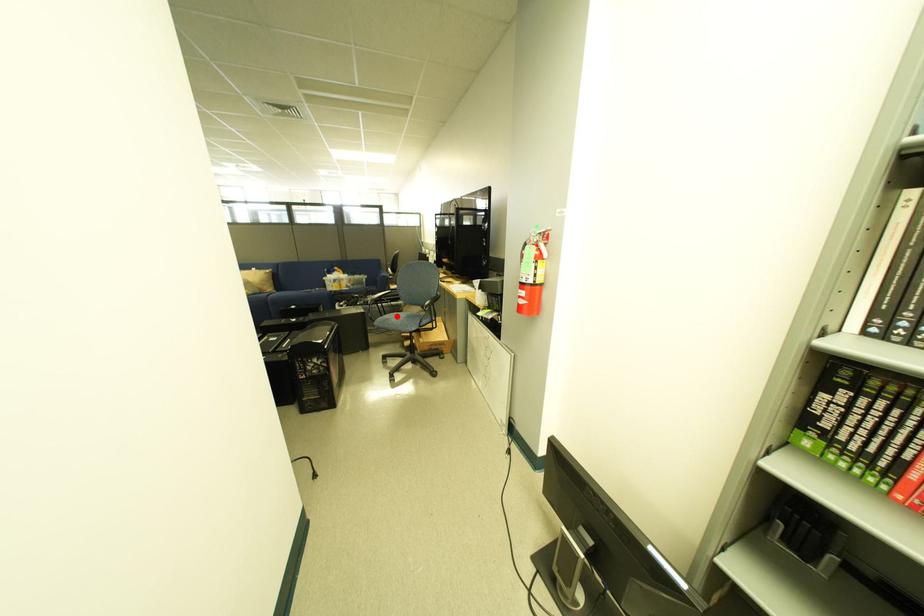
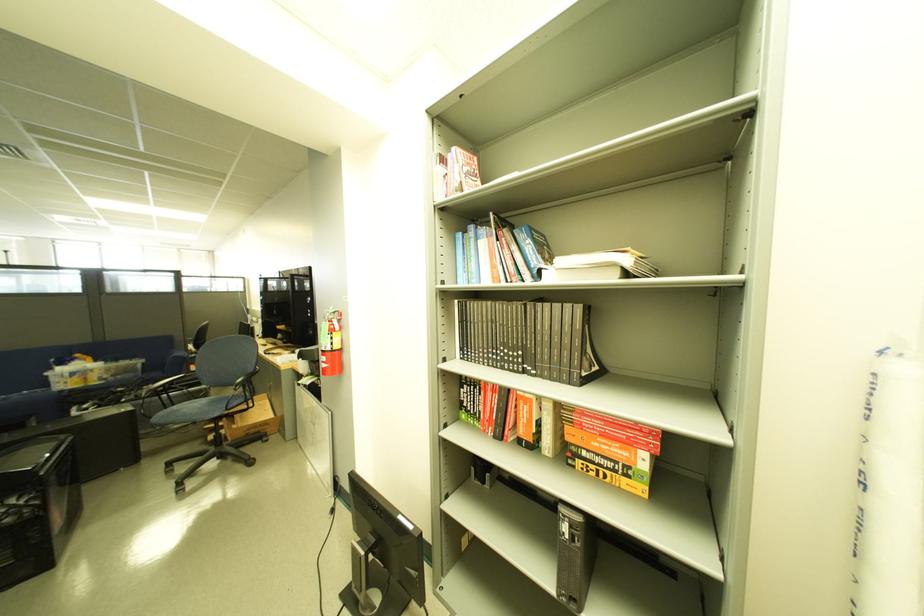
Where in the second image is the point corresponding to the highlighted location from the first image?

(185, 408)